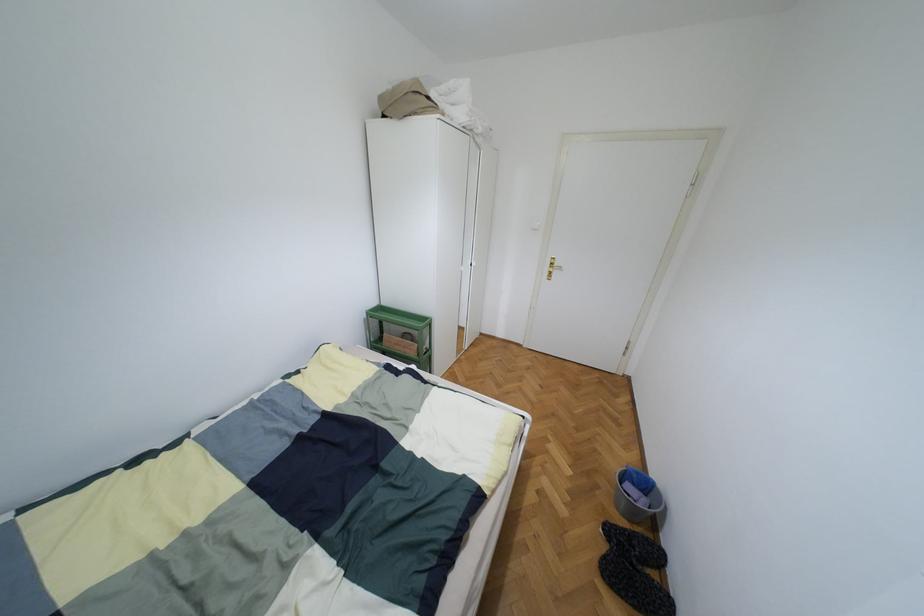
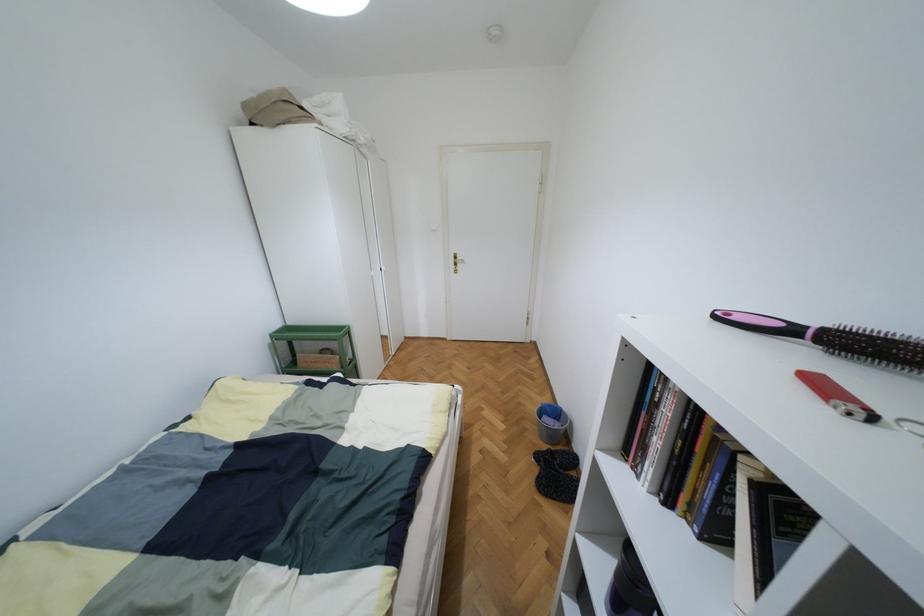
Question: How did the camera likely rotate?

Choices:
 (A) Left
 (B) Right
 (C) Up
 (D) Down

Answer: (B)